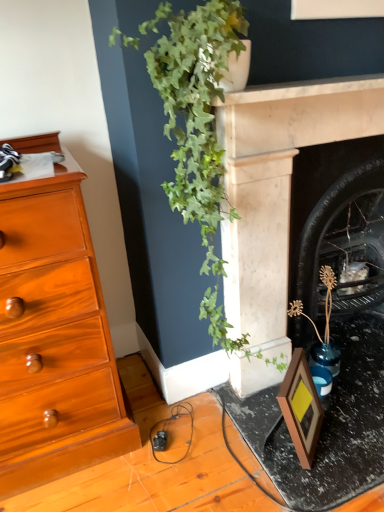
The image size is (384, 512). What are the coordinates of `blank space situated above matte black frame at lower right (from a real-world perspective)` in the screenshot? It's located at (328, 396).